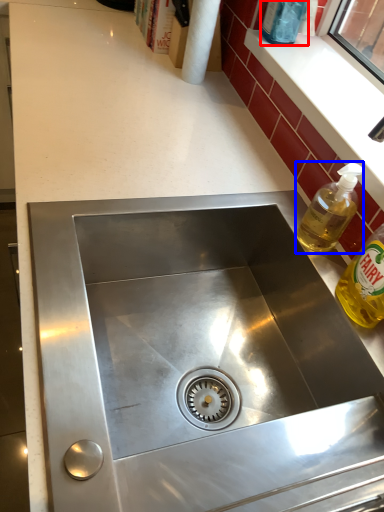
Question: Which of the following is the farthest to the observer, bottle (highlighted by a red box) or bottle (highlighted by a blue box)?

Choices:
 (A) bottle
 (B) bottle

Answer: (A)